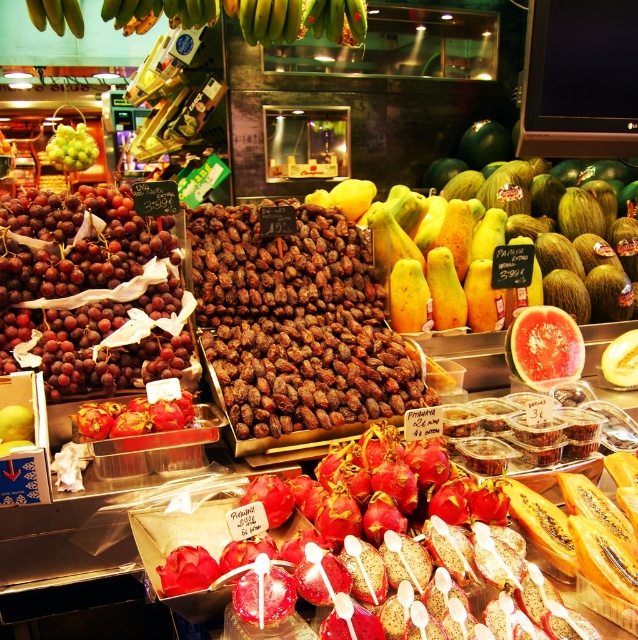
Does watermelon flesh at center have a lesser width compared to green matte bananas at upper center?

Correct, watermelon flesh at center's width is less than green matte bananas at upper center's.

Who is more forward, (561, 362) or (263, 26)?

Point (561, 362) is in front.

At what (x,y) coordinates should I click in order to perform the action: click on watermelon flesh at center. Please return your answer as a coordinate pair (x, y). This screenshot has width=638, height=640. Looking at the image, I should click on (544, 346).

Who is higher up, yellow matte papaya at center or watermelon flesh at center?

Positioned higher is yellow matte papaya at center.

Between point (517, 241) and point (544, 323), which one is positioned behind?

Point (517, 241)

Between point (417, 243) and point (516, 326), which one is positioned in front?

Point (516, 326)

You are a GUI agent. You are given a task and a screenshot of the screen. Output one action in this format:
    pyautogui.click(x=<x>, y=<y>)
    Task: Click on the yellow matte papaya at center
    
    Given the screenshot: What is the action you would take?
    pyautogui.click(x=493, y=259)

Can you confirm if shiny purple grapes at left is shorter than green matte bananas at upper center?

No, shiny purple grapes at left is not shorter than green matte bananas at upper center.

Between shiny purple grapes at left and green matte bananas at upper center, which one appears on the left side from the viewer's perspective?

From the viewer's perspective, shiny purple grapes at left appears more on the left side.

The image size is (638, 640). Find the location of `shiny purple grapes at left`. shiny purple grapes at left is located at coordinates (87, 244).